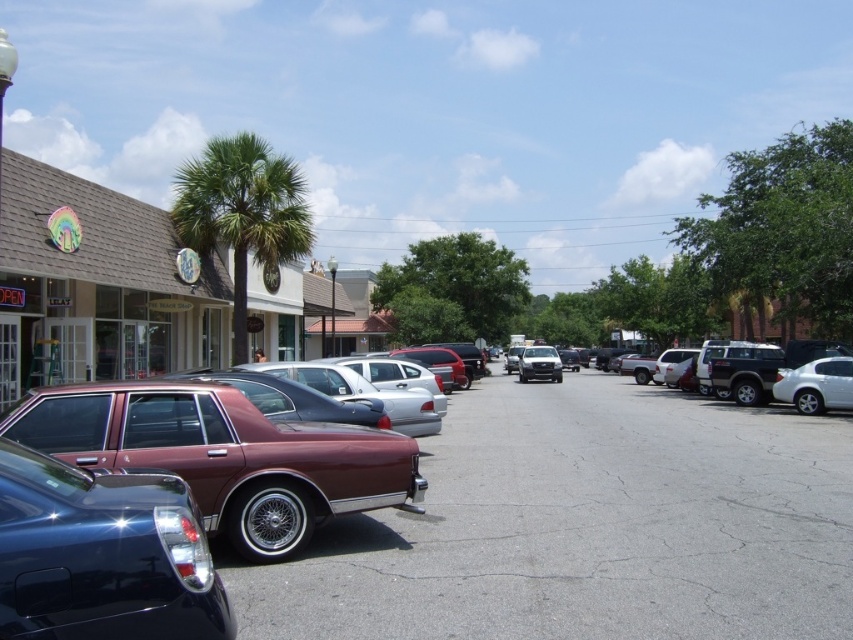
You are standing in the middle of the street looking towards the storefronts. There are two points marked in the image, one at coordinates point (213, 221) and the other at point (804, 381). Which point is closer to you?

Point (213, 221) is closer to you because it is further to the viewer than point (804, 381).

You are standing at the entrance of the parking lot and want to locate the green leafy palm tree at center. According to the coordinates provided, where should you look relative to the parking lot entrance?

The green leafy palm tree at center is located at coordinates point (242,211), which means it is positioned approximately one third of the way from the left and slightly above the center vertically relative to the parking lot entrance.

You are standing at the center of the street in the image. If you face the direction of the maroon metallic sedan at lower left, which direction should you turn to look towards the palm tree near the storefronts?

Since the maroon metallic sedan at lower left is located at point (224, 456), turning left would orient you towards the palm tree near the storefronts.